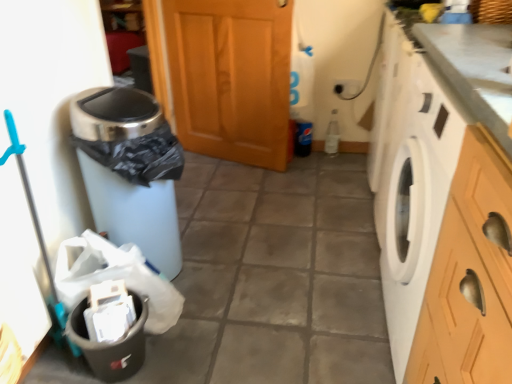
Question: From a real-world perspective, is black plastic recycling bin at lower left physically above wooden door at center?

Choices:
 (A) no
 (B) yes

Answer: (A)

Question: Is black plastic recycling bin at lower left taller than wooden door at center?

Choices:
 (A) yes
 (B) no

Answer: (B)

Question: Can wooden door at center be found inside black plastic recycling bin at lower left?

Choices:
 (A) yes
 (B) no

Answer: (B)

Question: From the image's perspective, is black plastic recycling bin at lower left below wooden door at center?

Choices:
 (A) no
 (B) yes

Answer: (B)

Question: Considering the relative positions of black plastic recycling bin at lower left and wooden door at center in the image provided, is black plastic recycling bin at lower left to the left of wooden door at center from the viewer's perspective?

Choices:
 (A) no
 (B) yes

Answer: (B)

Question: Is black plastic recycling bin at lower left not inside wooden door at center?

Choices:
 (A) yes
 (B) no

Answer: (A)

Question: Considering the relative positions of matte plastic trash can at left and black plastic trash can at left in the image provided, is matte plastic trash can at left to the right of black plastic trash can at left from the viewer's perspective?

Choices:
 (A) no
 (B) yes

Answer: (B)

Question: Is matte plastic trash can at left taller than black plastic trash can at left?

Choices:
 (A) no
 (B) yes

Answer: (B)

Question: From the image's perspective, does matte plastic trash can at left appear higher than black plastic trash can at left?

Choices:
 (A) no
 (B) yes

Answer: (B)

Question: Is matte plastic trash can at left closer to camera compared to black plastic trash can at left?

Choices:
 (A) yes
 (B) no

Answer: (A)

Question: Is matte plastic trash can at left thinner than black plastic trash can at left?

Choices:
 (A) yes
 (B) no

Answer: (B)

Question: Is matte plastic trash can at left further to camera compared to black plastic trash can at left?

Choices:
 (A) no
 (B) yes

Answer: (A)

Question: Considering the relative sizes of white glossy washing machine at right and matte plastic trash can at left in the image provided, is white glossy washing machine at right wider than matte plastic trash can at left?

Choices:
 (A) no
 (B) yes

Answer: (A)